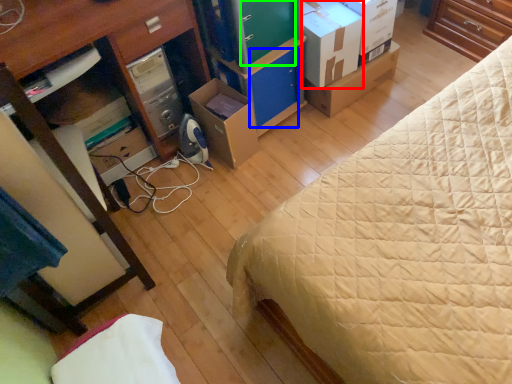
Question: Estimate the real-world distances between objects in this image. Which object is farther from cardboard box (highlighted by a red box), drawer (highlighted by a blue box) or drawer (highlighted by a green box)?

Choices:
 (A) drawer
 (B) drawer

Answer: (A)